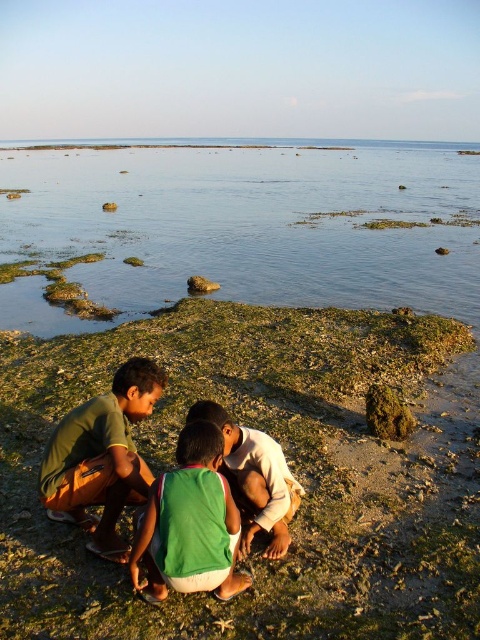
You are standing on the rocky shoreline and want to approach both the green cotton shirt at lower left and the green jersey at center. Which one should you head towards first to reach the closer one?

You should head towards the green cotton shirt at lower left first because it is closer to you than the green jersey at center, as the green cotton shirt at lower left is further to the viewer than green jersey at center.